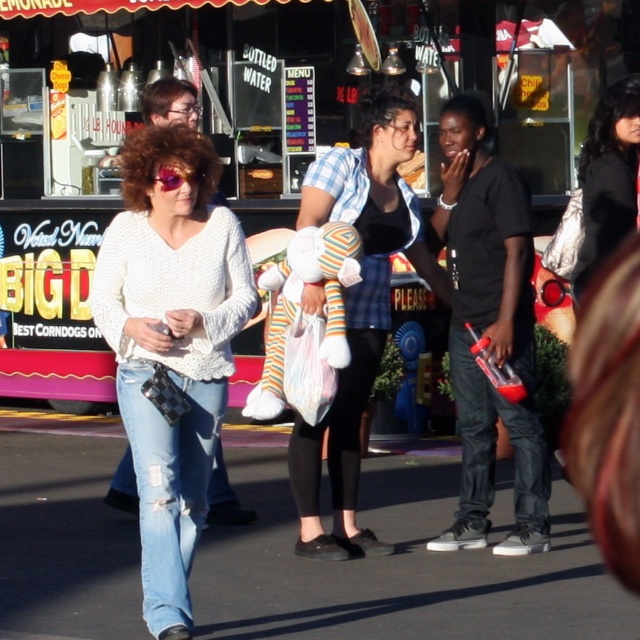
What object is located at the point with coordinates (490, 330) in the image?

The black matte shirt at center is located at point (490, 330).